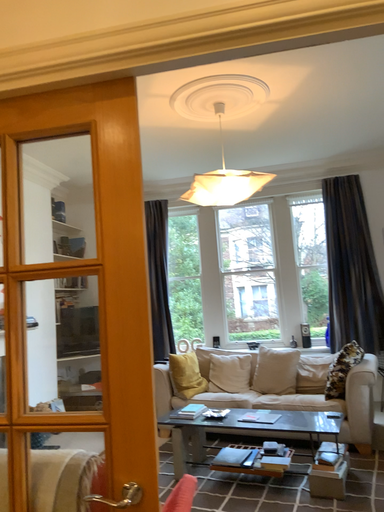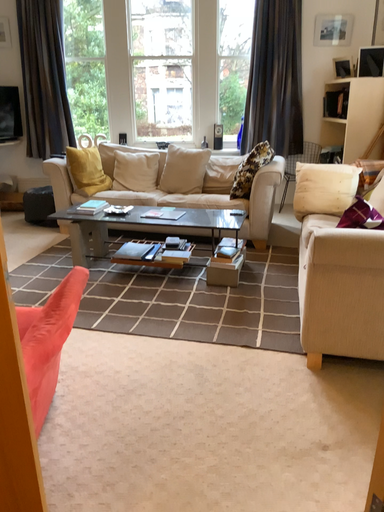
Question: How did the camera likely rotate when shooting the video?

Choices:
 (A) rotated downward
 (B) rotated upward

Answer: (A)